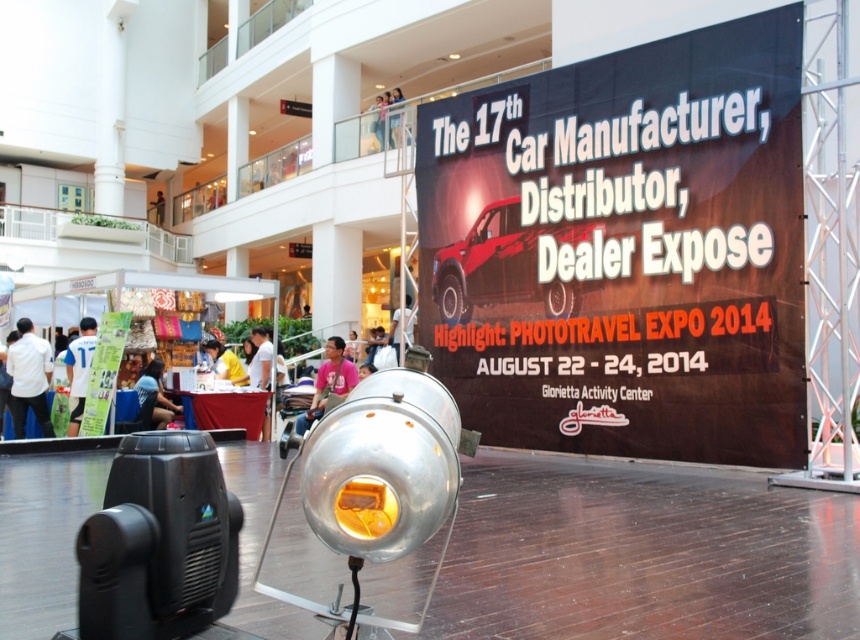
Can you confirm if white matte shirt at center is wider than light brown wooden railing at upper center?

Indeed, white matte shirt at center has a greater width compared to light brown wooden railing at upper center.

Which is in front, point (269, 349) or point (390, 125)?

Point (269, 349) is in front.

At what (x,y) coordinates should I click in order to perform the action: click on white matte shirt at center. Please return your answer as a coordinate pair (x, y). Looking at the image, I should click on (260, 358).

Can you confirm if light brown wooden railing at upper center is wider than light brown wooden chair at upper center?

No.

Between point (400, 113) and point (150, 218), which one is positioned in front?

Point (400, 113)

From the picture: Who is more distant from viewer, (392, 138) or (154, 216)?

Positioned behind is point (154, 216).

At what (x,y) coordinates should I click in order to perform the action: click on light brown wooden railing at upper center. Please return your answer as a coordinate pair (x, y). The width and height of the screenshot is (860, 640). Looking at the image, I should click on (395, 129).

Between white jersey at left and light brown wooden chair at upper center, which one has more height?

Standing taller between the two is white jersey at left.

Which is in front, point (69, 344) or point (163, 216)?

Point (69, 344) is in front.

Where is `white jersey at left`? white jersey at left is located at coordinates (78, 371).